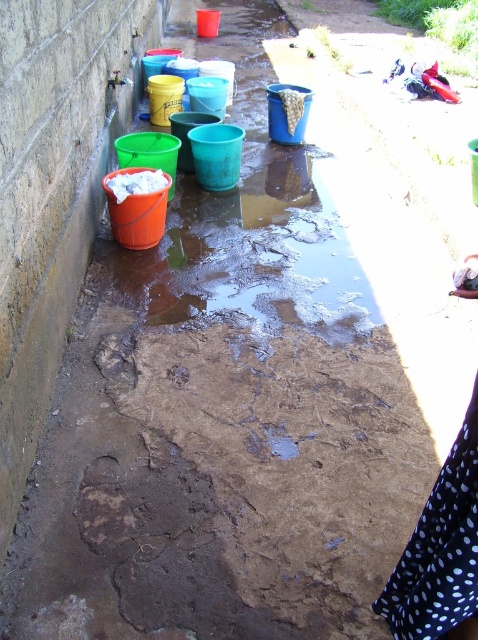
Question: Which point is closer to the camera taking this photo?

Choices:
 (A) (405, 560)
 (B) (338, 308)

Answer: (A)

Question: Which point appears closest to the camera in this image?

Choices:
 (A) (109, 291)
 (B) (431, 528)

Answer: (B)

Question: Which point is farther to the camera?

Choices:
 (A) (184, 250)
 (B) (453, 483)

Answer: (A)

Question: Is shiny plastic buckets at left behind black dotted fabric at lower right?

Choices:
 (A) no
 (B) yes

Answer: (B)

Question: From the image, what is the correct spatial relationship of shiny plastic buckets at left in relation to black dotted fabric at lower right?

Choices:
 (A) below
 (B) above

Answer: (B)

Question: Can you confirm if shiny plastic buckets at left is wider than black dotted fabric at lower right?

Choices:
 (A) yes
 (B) no

Answer: (A)